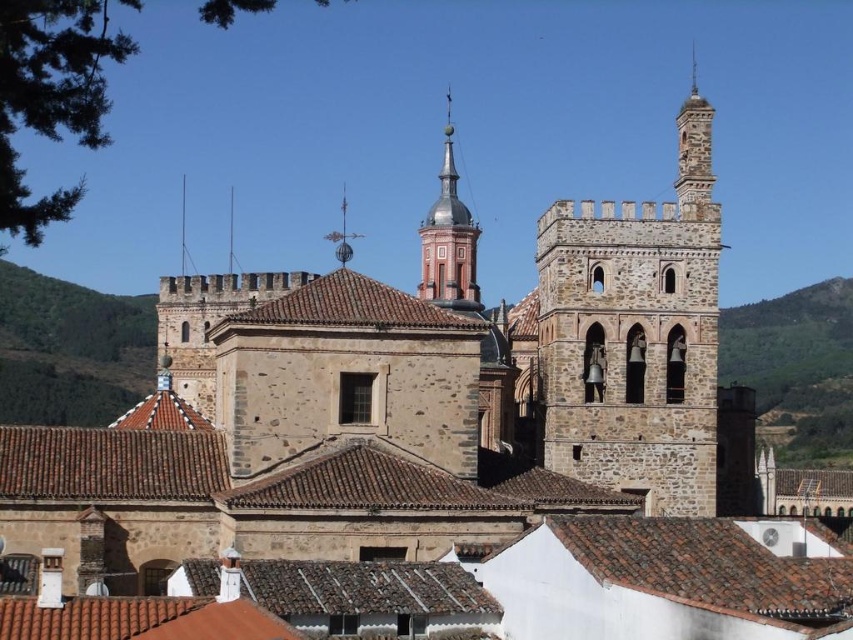
Question: Does stone tower at center have a larger size compared to smooth red brick tower at center?

Choices:
 (A) no
 (B) yes

Answer: (B)

Question: Does stone tower at center appear under smooth red brick tower at center?

Choices:
 (A) yes
 (B) no

Answer: (B)

Question: Among these points, which one is farthest from the camera?

Choices:
 (A) 471,262
 (B) 349,253
 (C) 578,426

Answer: (A)

Question: Which object is farther from the camera taking this photo?

Choices:
 (A) stone textured spire at upper right
 (B) polished silver spire at center

Answer: (A)

Question: Does stone tower at center have a lesser width compared to smooth red brick tower at center?

Choices:
 (A) no
 (B) yes

Answer: (A)

Question: Which object is farther from the camera taking this photo?

Choices:
 (A) smooth red brick tower at center
 (B) polished silver spire at center

Answer: (A)